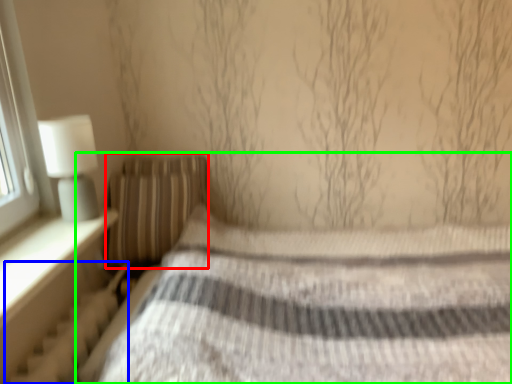
Question: Which object is the farthest from pillow (highlighted by a red box)? Choose among these: radiator (highlighted by a blue box) or bed (highlighted by a green box).

Choices:
 (A) radiator
 (B) bed

Answer: (B)